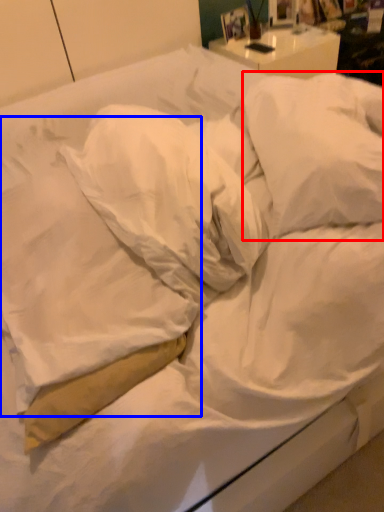
Question: Which object appears farthest to the camera in this image, pillow (highlighted by a red box) or pillow (highlighted by a blue box)?

Choices:
 (A) pillow
 (B) pillow

Answer: (A)